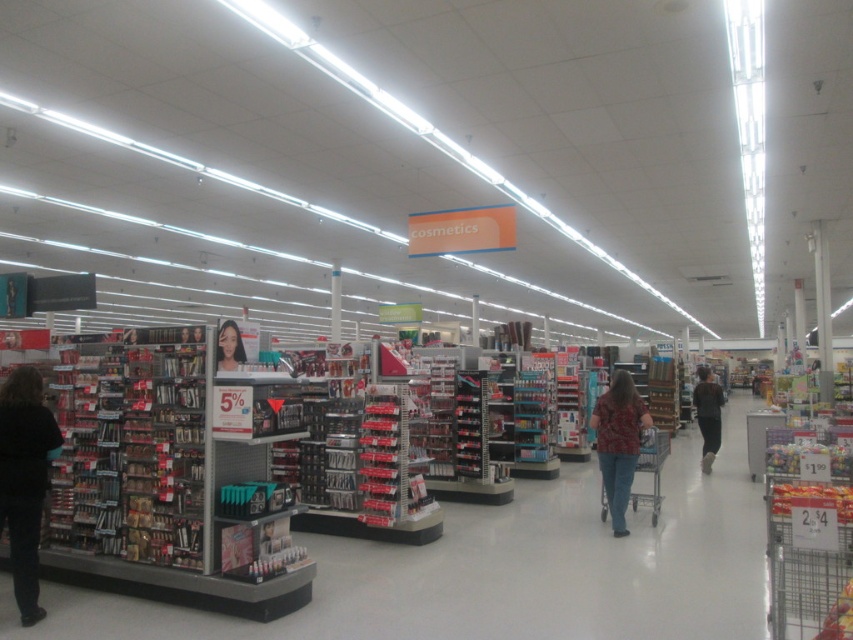
Which is in front, point (10, 396) or point (614, 456)?

Point (10, 396)

Does dark brown hair at left appear on the right side of floral shirt at center?

No, dark brown hair at left is not to the right of floral shirt at center.

Where is `dark brown hair at left`? The image size is (853, 640). dark brown hair at left is located at coordinates (24, 480).

Consider the image. How much distance is there between brown fuzzy sweater at center and smooth brown hair at center?

11.25 meters

Who is shorter, brown fuzzy sweater at center or smooth brown hair at center?

With less height is smooth brown hair at center.

Who is more distant from viewer, (718,436) or (227,353)?

Positioned behind is point (718,436).

I want to click on brown fuzzy sweater at center, so click(x=708, y=413).

Does dark brown hair at left have a lesser width compared to smooth brown hair at center?

Incorrect, dark brown hair at left's width is not less than smooth brown hair at center's.

Locate an element on the screen. The height and width of the screenshot is (640, 853). dark brown hair at left is located at coordinates (24, 480).